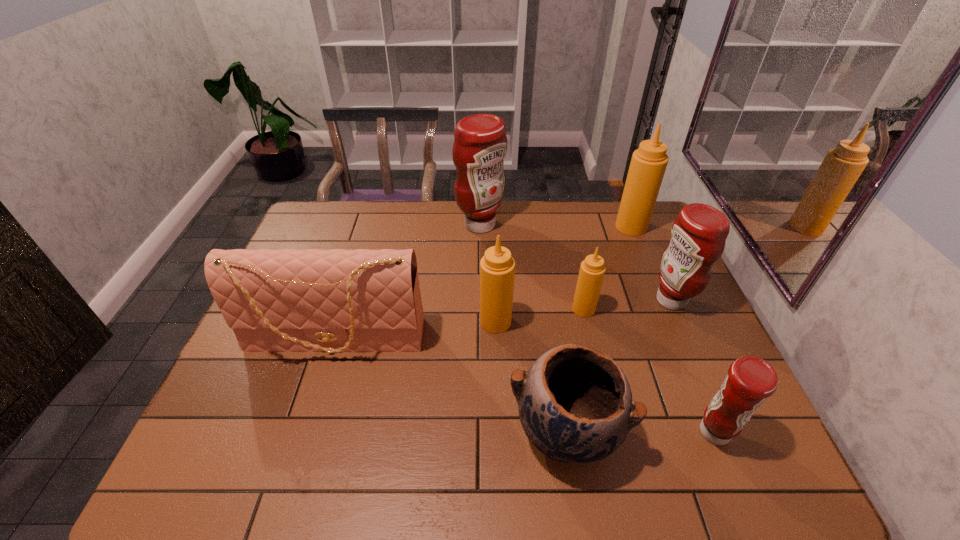
Find the location of a particular element. Image resolution: width=960 pixels, height=540 pixels. condiment that is the third closest one to the blue pottery is located at coordinates (592, 270).

Identify which condiment is the fourth nearest to the second tan condiment from left to right. Please provide its 2D coordinates. Your answer should be formatted as a tuple, i.e. [(x, y)], where the tuple contains the x and y coordinates of a point satisfying the conditions above.

[(648, 164)]

Select which red condiment is the second closest to the second smallest tan condiment. Please provide its 2D coordinates. Your answer should be formatted as a tuple, i.e. [(x, y)], where the tuple contains the x and y coordinates of a point satisfying the conditions above.

[(698, 236)]

Locate which red condiment ranks second in proximity to the smallest red condiment. Please provide its 2D coordinates. Your answer should be formatted as a tuple, i.e. [(x, y)], where the tuple contains the x and y coordinates of a point satisfying the conditions above.

[(480, 143)]

Select which tan condiment is the second closest to the fourth condiment from right to left. Please provide its 2D coordinates. Your answer should be formatted as a tuple, i.e. [(x, y)], where the tuple contains the x and y coordinates of a point satisfying the conditions above.

[(648, 164)]

Where is `the closest tan condiment to the second biggest tan condiment`? the closest tan condiment to the second biggest tan condiment is located at coordinates (592, 270).

Image resolution: width=960 pixels, height=540 pixels. In order to click on vacant space that satisfies the following two spatial constraints: 1. on the front side of the nearest red condiment; 2. on the left side of the biggest red condiment in this screenshot , I will do `click(481, 432)`.

The image size is (960, 540). I want to click on free space in the image that satisfies the following two spatial constraints: 1. on the front-facing side of the pink handbag; 2. on the left side of the nearest red condiment, so click(307, 432).

The height and width of the screenshot is (540, 960). In order to click on free location that satisfies the following two spatial constraints: 1. on the back side of the blue pottery; 2. on the right side of the smallest tan condiment in this screenshot , I will do (547, 309).

The height and width of the screenshot is (540, 960). I want to click on vacant region that satisfies the following two spatial constraints: 1. on the front side of the farthest red condiment; 2. on the left side of the second biggest tan condiment, so click(x=480, y=322).